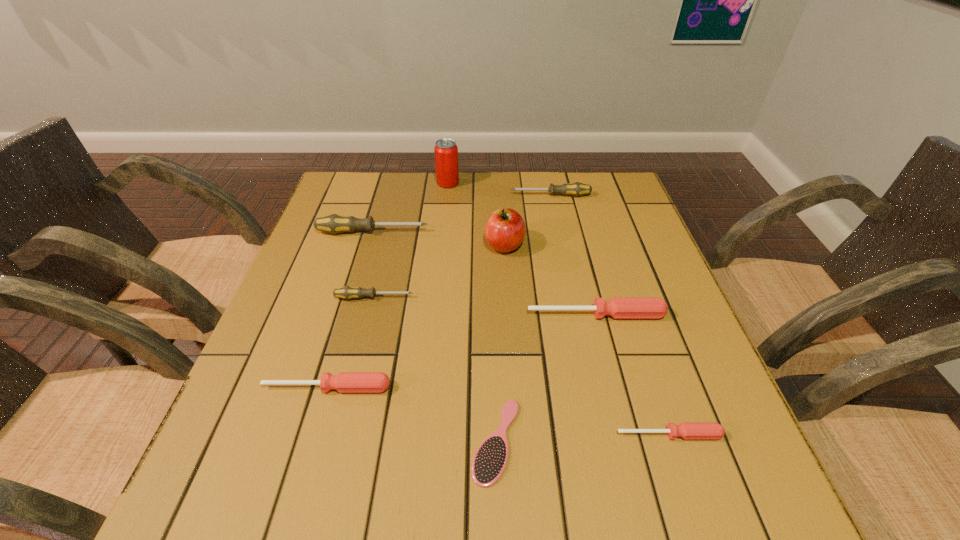
The image size is (960, 540). What are the coordinates of `vacant space in between the shortest object and the red can` in the screenshot? It's located at (472, 312).

Where is `empty space that is in between the second smallest gray screwdriver and the shortest object`? This screenshot has width=960, height=540. empty space that is in between the second smallest gray screwdriver and the shortest object is located at coordinates (523, 318).

Where is `unoccupied area between the farthest object and the second farthest object`? The image size is (960, 540). unoccupied area between the farthest object and the second farthest object is located at coordinates (499, 189).

Find the location of a particular element. This screenshot has width=960, height=540. free area in between the shortest object and the tallest screwdriver is located at coordinates (434, 336).

Identify the location of vacant area between the fifth farthest screwdriver and the eighth tallest object. The image size is (960, 540). (498, 411).

Find the location of a particular element. This screenshot has width=960, height=540. free spot between the smallest gray screwdriver and the fifth farthest screwdriver is located at coordinates (350, 343).

Locate an element on the screen. Image resolution: width=960 pixels, height=540 pixels. free space between the shortest object and the red apple is located at coordinates (500, 343).

Identify which object is the fourth nearest to the nearest screwdriver. Please provide its 2D coordinates. Your answer should be formatted as a tuple, i.e. [(x, y)], where the tuple contains the x and y coordinates of a point satisfying the conditions above.

[(505, 229)]

Locate which object ranks second in proximity to the rightmost gray screwdriver. Please provide its 2D coordinates. Your answer should be formatted as a tuple, i.e. [(x, y)], where the tuple contains the x and y coordinates of a point satisfying the conditions above.

[(505, 229)]

I want to click on screwdriver that is the fourth nearest to the farthest red screwdriver, so click(x=334, y=223).